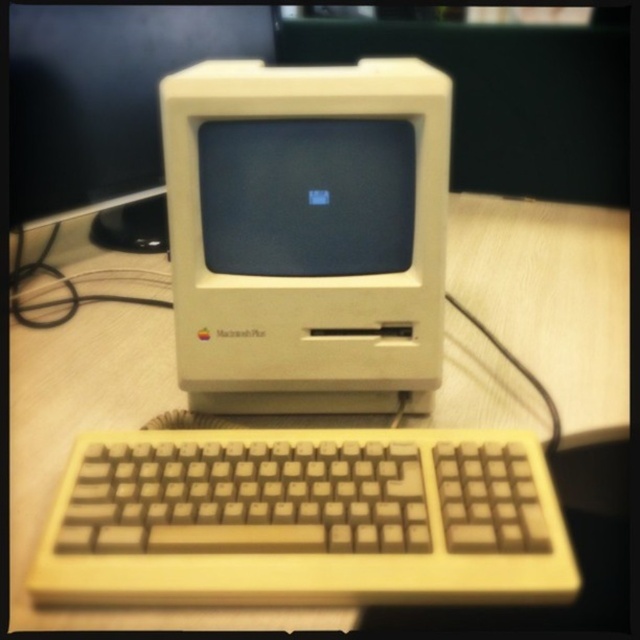
Which is behind, point (440, 276) or point (196, 132)?

Positioned behind is point (440, 276).

Which is more to the left, white plastic computer at center or matte plastic monitor at center?

Positioned to the left is matte plastic monitor at center.

Is point (320, 225) positioned behind point (396, 132)?

Yes, it is behind point (396, 132).

Identify the location of white plastic computer at center. The width and height of the screenshot is (640, 640). (307, 234).

Can you confirm if beige wood computer desk at center is smaller than matte plastic monitor at center?

Incorrect, beige wood computer desk at center is not smaller in size than matte plastic monitor at center.

Does beige wood computer desk at center appear under matte plastic monitor at center?

Correct, beige wood computer desk at center is located below matte plastic monitor at center.

Between point (170, 392) and point (323, 182), which one is positioned in front?

Point (323, 182) is more forward.

Locate an element on the screen. The width and height of the screenshot is (640, 640). beige wood computer desk at center is located at coordinates (113, 428).

Does beige plastic keyboard at lower center have a greater height compared to matte plastic monitor at center?

In fact, beige plastic keyboard at lower center may be shorter than matte plastic monitor at center.

Is point (273, 499) closer to viewer compared to point (209, 157)?

Yes.

Find the location of a particular element. beige plastic keyboard at lower center is located at coordinates (305, 518).